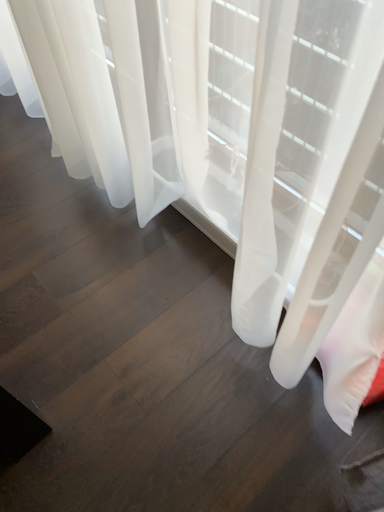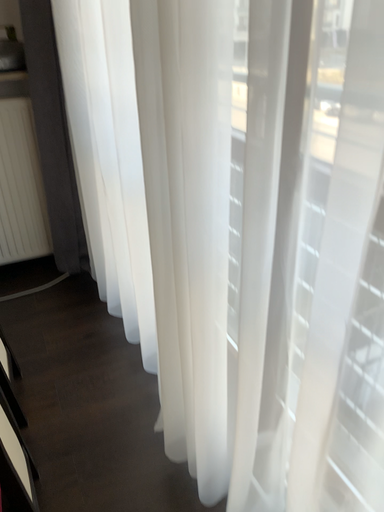
Question: Which way did the camera rotate in the video?

Choices:
 (A) rotated downward
 (B) rotated upward

Answer: (B)